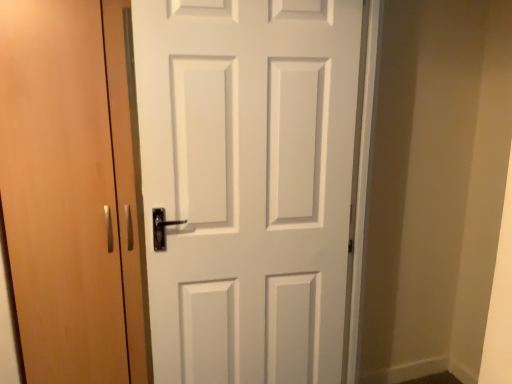
Question: In which direction should I rotate to look at white matte door at center, which ranks as the 2th door in left-to-right order?

Choices:
 (A) right
 (B) left

Answer: (A)

Question: From the image's perspective, does light brown wood door at left, which appears as the 1th door when viewed from the left, appear lower than white matte door at center, the 1th door in the right-to-left sequence?

Choices:
 (A) no
 (B) yes

Answer: (A)

Question: Could white matte door at center, which ranks as the 2th door in left-to-right order, be considered to be inside light brown wood door at left, which appears as the 1th door when viewed from the left?

Choices:
 (A) yes
 (B) no

Answer: (B)

Question: Is light brown wood door at left, which appears as the 1th door when viewed from the left, in front of white matte door at center, the 1th door in the right-to-left sequence?

Choices:
 (A) yes
 (B) no

Answer: (B)

Question: Is light brown wood door at left, the second door when ordered from right to left, at the left side of white matte door at center, which ranks as the 2th door in left-to-right order?

Choices:
 (A) no
 (B) yes

Answer: (B)

Question: Is light brown wood door at left, which appears as the 1th door when viewed from the left, looking in the opposite direction of white matte door at center, which ranks as the 2th door in left-to-right order?

Choices:
 (A) yes
 (B) no

Answer: (B)

Question: From the image's perspective, does light brown wood door at left, which appears as the 1th door when viewed from the left, appear higher than white matte door at center, which ranks as the 2th door in left-to-right order?

Choices:
 (A) yes
 (B) no

Answer: (A)

Question: From the image's perspective, does white matte door at center, which ranks as the 2th door in left-to-right order, appear higher than light brown wood door at left, which appears as the 1th door when viewed from the left?

Choices:
 (A) no
 (B) yes

Answer: (A)

Question: Does white matte door at center, the 1th door in the right-to-left sequence, have a greater height compared to light brown wood door at left, which appears as the 1th door when viewed from the left?

Choices:
 (A) no
 (B) yes

Answer: (A)

Question: Does white matte door at center, the 1th door in the right-to-left sequence, appear on the right side of light brown wood door at left, which appears as the 1th door when viewed from the left?

Choices:
 (A) no
 (B) yes

Answer: (B)

Question: Is white matte door at center, which ranks as the 2th door in left-to-right order, outside of light brown wood door at left, the second door when ordered from right to left?

Choices:
 (A) no
 (B) yes

Answer: (B)

Question: Is white matte door at center, the 1th door in the right-to-left sequence, further to the viewer compared to light brown wood door at left, which appears as the 1th door when viewed from the left?

Choices:
 (A) yes
 (B) no

Answer: (B)

Question: Is white matte door at center, the 1th door in the right-to-left sequence, turned away from light brown wood door at left, the second door when ordered from right to left?

Choices:
 (A) no
 (B) yes

Answer: (A)

Question: Considering their positions, is light brown wood door at left, which appears as the 1th door when viewed from the left, located in front of or behind white matte door at center, the 1th door in the right-to-left sequence?

Choices:
 (A) behind
 (B) front

Answer: (A)